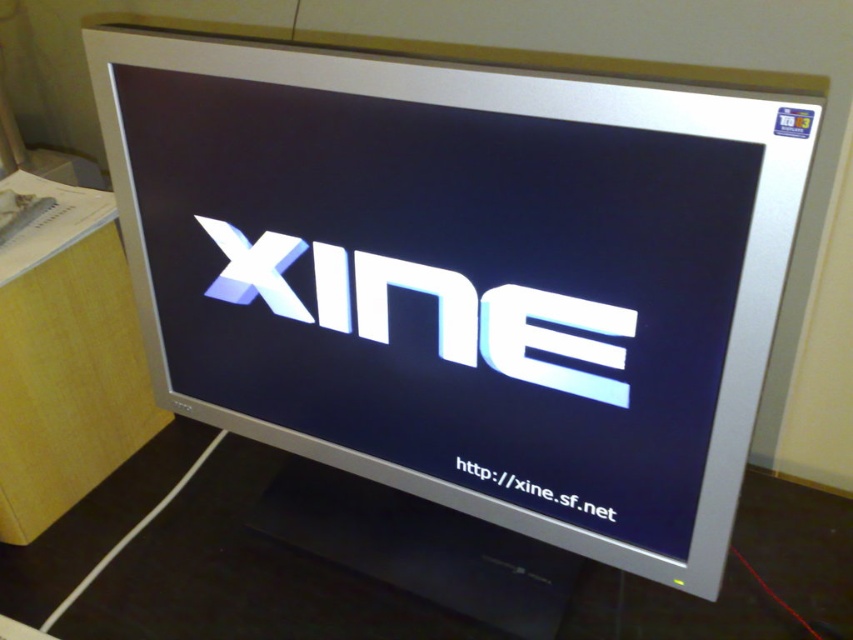
You are trying to reach the white glossy text at center to clean it, but there is a yellow wood table at left in the way. Can you move the table to access the text?

The white glossy text at center is behind the yellow wood table at left, so you cannot access it by moving the table since the text is located behind the table from your viewpoint.

You are setting up a presentation and need to ensure that both the shiny metallic xine at center and the white glossy text at center are clearly visible to the audience. Based on their positions, which object is located to the left of the other?

The shiny metallic xine at center is positioned on the left side of white glossy text at center.

You are setting up a new monitor and want to ensure that the shiny metallic xine at center and the white glossy text at center are both visible. Based on the image, which object might require more horizontal space on the monitor screen?

The shiny metallic xine at center might require more horizontal space on the monitor screen since it is wider than the white glossy text at center.